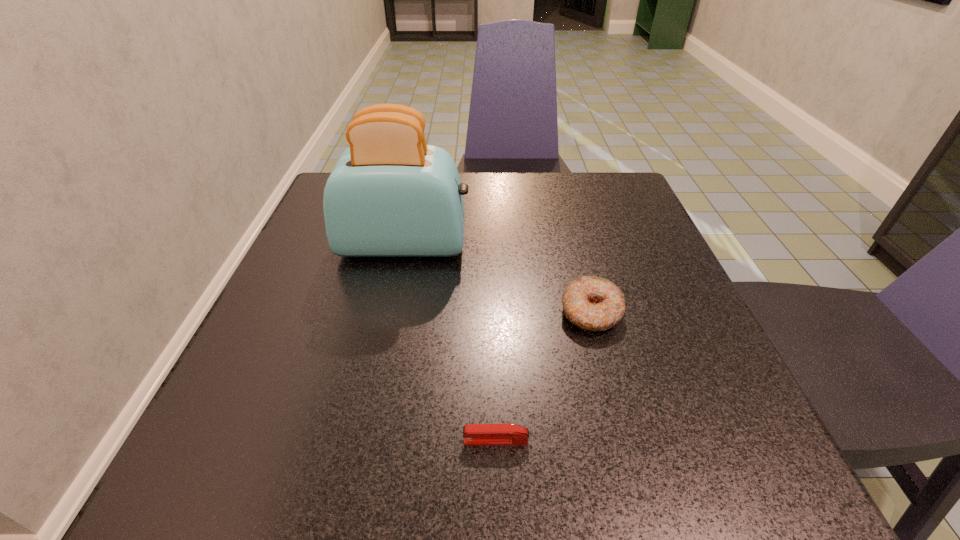
The height and width of the screenshot is (540, 960). I want to click on free space that satisfies the following two spatial constraints: 1. on the front side of the doughnut; 2. on the front-facing side of the shortest object, so click(x=624, y=441).